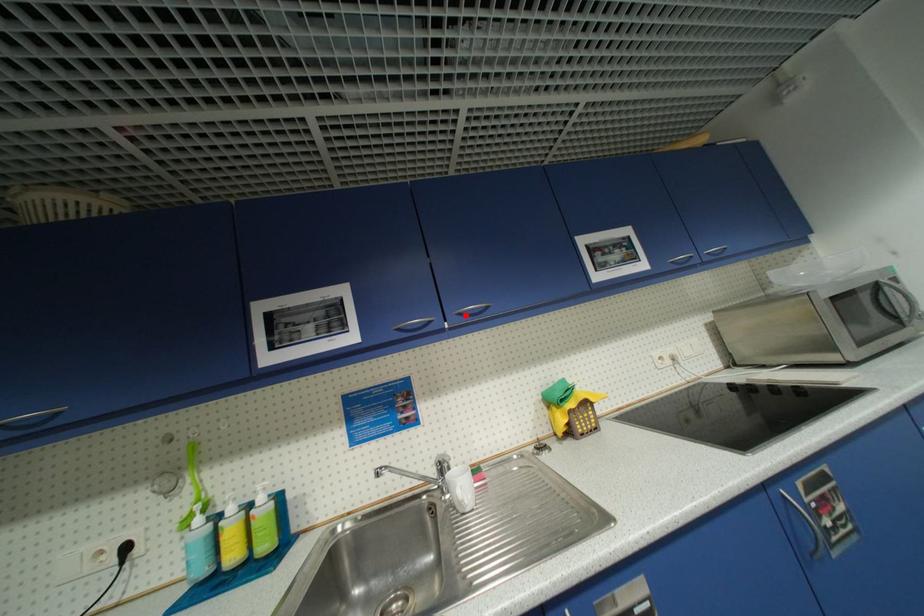
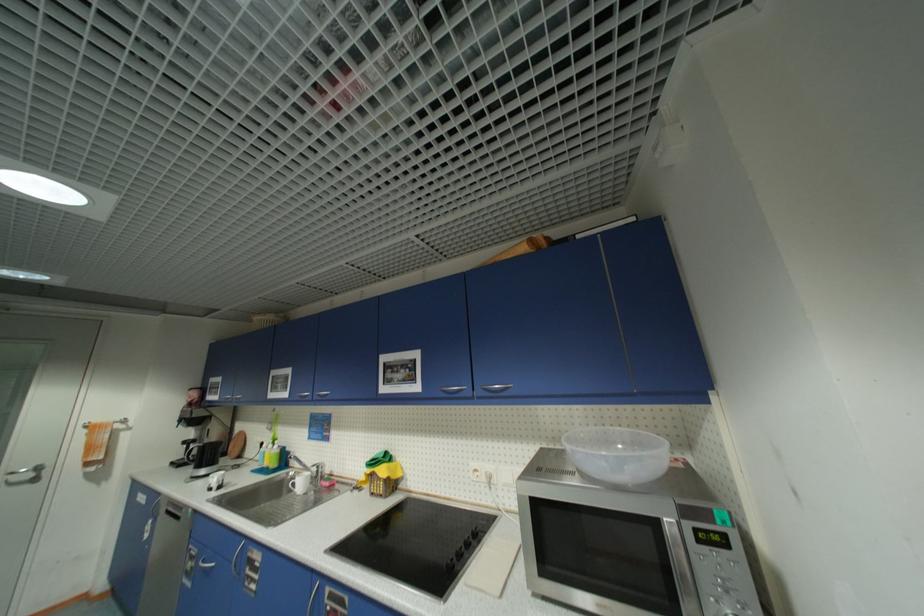
The point at the highlighted location is marked in the first image. Where is the corresponding point in the second image?

(323, 395)